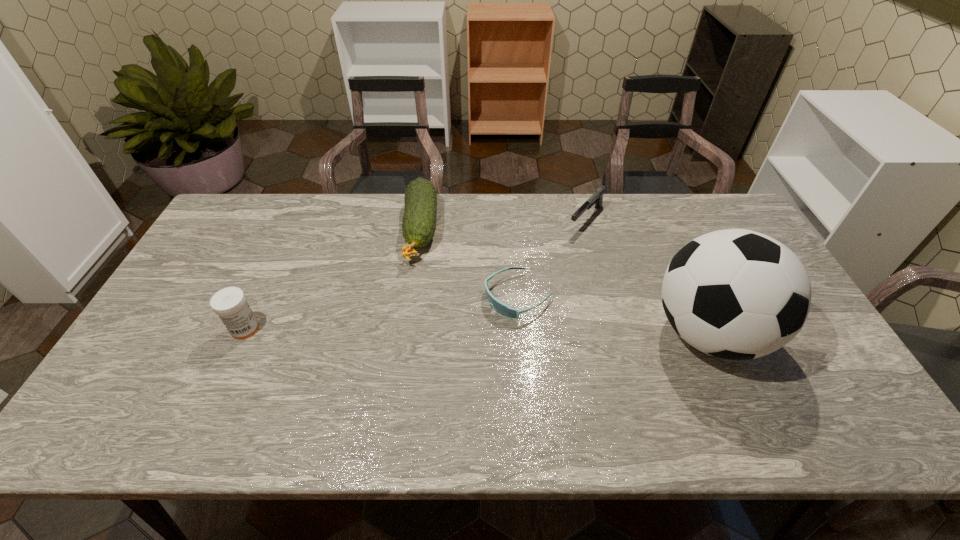
You are a GUI agent. You are given a task and a screenshot of the screen. Output one action in this format:
    pyautogui.click(x=<x>, y=<y>)
    Task: Click on the gun at the far edge
    Image resolution: width=960 pixels, height=540 pixels.
    Given the screenshot: What is the action you would take?
    pyautogui.click(x=597, y=198)

I want to click on cucumber located at the far edge, so click(x=419, y=222).

Find the location of a particular element. object present at the near edge is located at coordinates (737, 294).

This screenshot has height=540, width=960. I want to click on object located in the right edge section of the desktop, so click(737, 294).

Identify the location of object that is at the near right corner. (737, 294).

The image size is (960, 540). What are the coordinates of `vacant space at the far edge` in the screenshot? It's located at (524, 206).

The width and height of the screenshot is (960, 540). I want to click on vacant space at the left edge, so click(217, 256).

You are a GUI agent. You are given a task and a screenshot of the screen. Output one action in this format:
    pyautogui.click(x=<x>, y=<y>)
    Task: Click on the vacant space at the far left corner
    The width and height of the screenshot is (960, 540).
    Given the screenshot: What is the action you would take?
    pyautogui.click(x=225, y=216)

The image size is (960, 540). I want to click on vacant space at the far right corner of the desktop, so click(x=722, y=226).

Identify the location of vacant area between the fourth tallest object and the third object from left to right. The height and width of the screenshot is (540, 960). (552, 258).